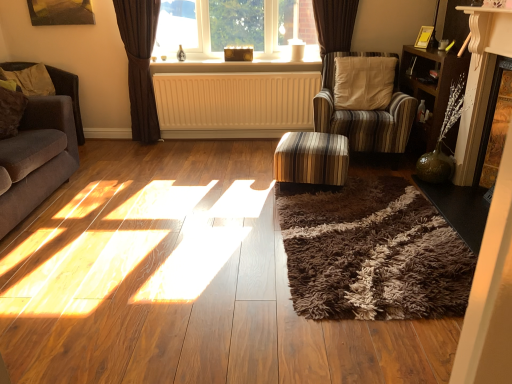
Question: Is yellow matte radiator at center positioned before wooden bookshelf at right?

Choices:
 (A) yes
 (B) no

Answer: (B)

Question: Can you confirm if yellow matte radiator at center is positioned to the right of wooden bookshelf at right?

Choices:
 (A) no
 (B) yes

Answer: (A)

Question: From a real-world perspective, does yellow matte radiator at center stand above wooden bookshelf at right?

Choices:
 (A) no
 (B) yes

Answer: (A)

Question: Is yellow matte radiator at center bigger than wooden bookshelf at right?

Choices:
 (A) no
 (B) yes

Answer: (A)

Question: Is yellow matte radiator at center thinner than wooden bookshelf at right?

Choices:
 (A) yes
 (B) no

Answer: (A)

Question: Is yellow matte radiator at center far away from wooden bookshelf at right?

Choices:
 (A) yes
 (B) no

Answer: (A)

Question: From a real-world perspective, is velvet brown couch at left under brown fabric armchair at left?

Choices:
 (A) no
 (B) yes

Answer: (A)

Question: Is velvet brown couch at left positioned before brown fabric armchair at left?

Choices:
 (A) no
 (B) yes

Answer: (B)

Question: From the image's perspective, is velvet brown couch at left located beneath brown fabric armchair at left?

Choices:
 (A) no
 (B) yes

Answer: (B)

Question: Is there a large distance between velvet brown couch at left and brown fabric armchair at left?

Choices:
 (A) yes
 (B) no

Answer: (A)

Question: Considering the relative sizes of velvet brown couch at left and brown fabric armchair at left in the image provided, is velvet brown couch at left shorter than brown fabric armchair at left?

Choices:
 (A) yes
 (B) no

Answer: (B)

Question: From a real-world perspective, is velvet brown couch at left on top of brown fabric armchair at left?

Choices:
 (A) no
 (B) yes

Answer: (B)

Question: Can you confirm if striped fabric ottoman at center is smaller than soft beige fabric pillow at left?

Choices:
 (A) yes
 (B) no

Answer: (B)